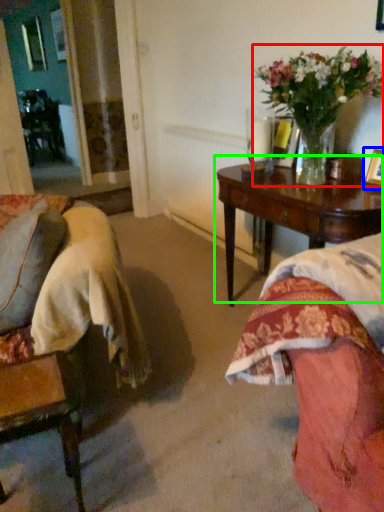
Question: Considering the real-world distances, which object is closest to houseplant (highlighted by a red box)? picture frame (highlighted by a blue box) or table (highlighted by a green box).

Choices:
 (A) picture frame
 (B) table

Answer: (B)